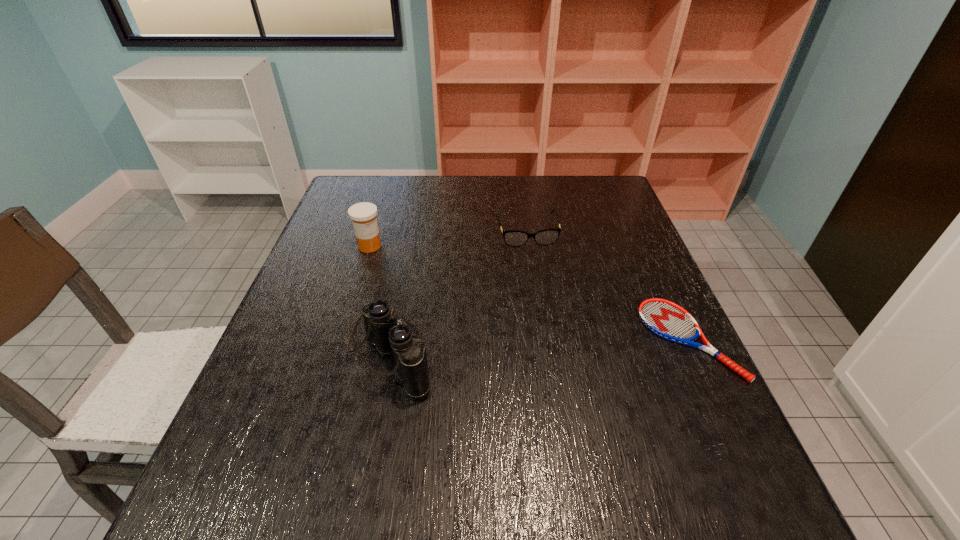
You are a GUI agent. You are given a task and a screenshot of the screen. Output one action in this format:
    pyautogui.click(x=<x>, y=<y>)
    Task: Click on the free space between the second tallest object and the rightmost object
    
    Given the screenshot: What is the action you would take?
    pyautogui.click(x=529, y=293)

The image size is (960, 540). What are the coordinates of `unoccupied position between the second object from right to left and the tennis racket` in the screenshot? It's located at (608, 286).

Where is `object that can be found as the closest to the tennis racket`? The width and height of the screenshot is (960, 540). object that can be found as the closest to the tennis racket is located at coordinates click(x=514, y=238).

You are a GUI agent. You are given a task and a screenshot of the screen. Output one action in this format:
    pyautogui.click(x=<x>, y=<y>)
    Task: Click on the object that is the closest to the second shortest object
    Image resolution: width=960 pixels, height=540 pixels.
    Given the screenshot: What is the action you would take?
    pyautogui.click(x=668, y=320)

Image resolution: width=960 pixels, height=540 pixels. Find the location of `vacant region that satisfies the following two spatial constraints: 1. on the front side of the second tallest object; 2. on the right side of the shortest object`. vacant region that satisfies the following two spatial constraints: 1. on the front side of the second tallest object; 2. on the right side of the shortest object is located at coordinates (341, 340).

Where is `vacant region that satisfies the following two spatial constraints: 1. on the back side of the binoculars; 2. on the right side of the second shortest object`? Image resolution: width=960 pixels, height=540 pixels. vacant region that satisfies the following two spatial constraints: 1. on the back side of the binoculars; 2. on the right side of the second shortest object is located at coordinates (412, 232).